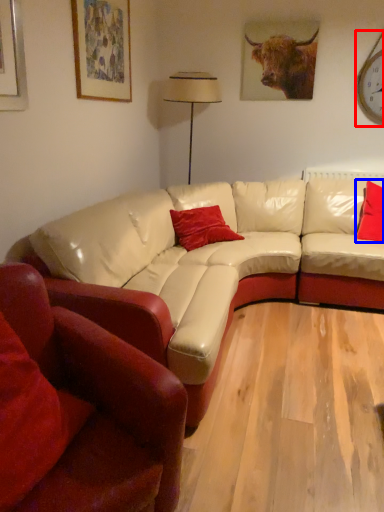
Question: Among these objects, which one is nearest to the camera, clock (highlighted by a red box) or pillow (highlighted by a blue box)?

Choices:
 (A) clock
 (B) pillow

Answer: (B)